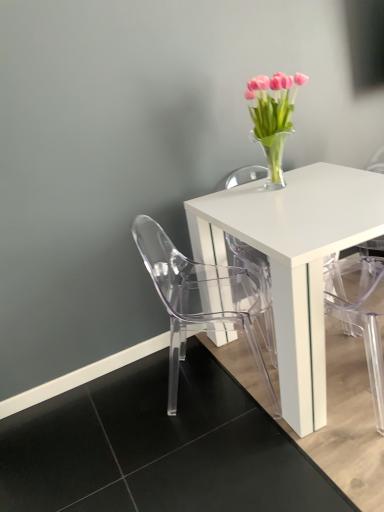
I want to click on vacant space in between white glossy table at center and transparent plastic armchair at lower right, so click(343, 434).